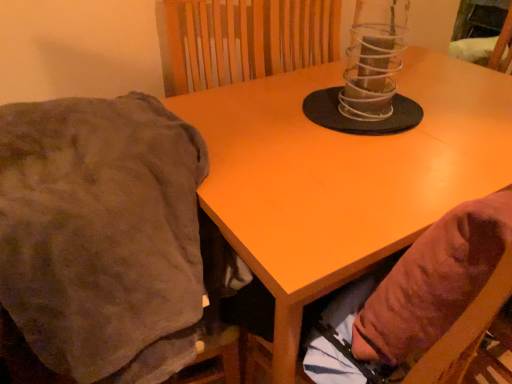
At what (x,y) coordinates should I click in order to perform the action: click on clear plastic candle holder at center. Please return your answer as a coordinate pair (x, y). Looking at the image, I should click on (371, 71).

What do you see at coordinates (342, 176) in the screenshot?
I see `matte orange table at center` at bounding box center [342, 176].

I want to click on brown fabric bean bag chair at lower right, so click(x=426, y=283).

Which is more to the right, matte orange table at center or brown fuzzy blanket at left?

matte orange table at center.

Is point (287, 243) closer to camera compared to point (5, 160)?

No, it is not.

From the image's perspective, between matte orange table at center and brown fuzzy blanket at left, which one is located above?

matte orange table at center.

Is matte orange table at center thinner than brown fuzzy blanket at left?

In fact, matte orange table at center might be wider than brown fuzzy blanket at left.

From a real-world perspective, is brown fuzzy blanket at left physically below matte orange table at center?

No, from a real-world perspective, brown fuzzy blanket at left is not below matte orange table at center.

You are a GUI agent. You are given a task and a screenshot of the screen. Output one action in this format:
    pyautogui.click(x=<x>, y=<y>)
    Task: Click on the blanket lying on the left of matte orange table at center
    This screenshot has width=512, height=384.
    Given the screenshot: What is the action you would take?
    pyautogui.click(x=102, y=235)

Considering the relative positions of brown fuzzy blanket at left and matte orange table at center in the image provided, is brown fuzzy blanket at left behind matte orange table at center?

No, brown fuzzy blanket at left is closer to the camera.

Could matte orange table at center be considered to be inside brown fuzzy blanket at left?

Actually, matte orange table at center is outside brown fuzzy blanket at left.

From a real-world perspective, which is physically below, matte orange table at center or clear plastic candle holder at center?

In real-world perspective, matte orange table at center is lower.

Do you think matte orange table at center is within clear plastic candle holder at center, or outside of it?

matte orange table at center lies outside clear plastic candle holder at center.

Consider the image. Which of these two, matte orange table at center or clear plastic candle holder at center, is wider?

matte orange table at center.

The image size is (512, 384). In order to click on candle holder behind the matte orange table at center in this screenshot , I will do `click(371, 71)`.

Is point (264, 175) behind point (447, 232)?

Yes.

Is matte orange table at center to the left or to the right of brown fabric bean bag chair at lower right in the image?

matte orange table at center is to the left of brown fabric bean bag chair at lower right.

From a real-world perspective, is matte orange table at center on brown fabric bean bag chair at lower right?

No, from a real-world perspective, matte orange table at center is not on top of brown fabric bean bag chair at lower right.

Can you confirm if matte orange table at center is wider than brown fabric bean bag chair at lower right?

Correct, the width of matte orange table at center exceeds that of brown fabric bean bag chair at lower right.

Which point is more forward, (56, 286) or (368, 54)?

Positioned in front is point (56, 286).

Considering the relative sizes of brown fuzzy blanket at left and clear plastic candle holder at center in the image provided, is brown fuzzy blanket at left smaller than clear plastic candle holder at center?

Incorrect, brown fuzzy blanket at left is not smaller in size than clear plastic candle holder at center.

Which object is further away from the camera, brown fuzzy blanket at left or clear plastic candle holder at center?

clear plastic candle holder at center.

Is brown fuzzy blanket at left shorter than clear plastic candle holder at center?

In fact, brown fuzzy blanket at left may be taller than clear plastic candle holder at center.

Between point (41, 321) and point (489, 212), which one is positioned behind?

The point (41, 321) is farther from the camera.

From a real-world perspective, which object stands above the other?

From a 3D spatial view, brown fabric bean bag chair at lower right is above.

Which of these two, brown fuzzy blanket at left or brown fabric bean bag chair at lower right, stands taller?

brown fuzzy blanket at left.

The height and width of the screenshot is (384, 512). Find the location of `bean bag chair above the brown fuzzy blanket at left (from the image's perspective)`. bean bag chair above the brown fuzzy blanket at left (from the image's perspective) is located at coordinates (426, 283).

Is clear plastic candle holder at center spatially inside matte orange table at center, or outside of it?

clear plastic candle holder at center is located beyond the bounds of matte orange table at center.

Considering the relative sizes of clear plastic candle holder at center and matte orange table at center in the image provided, is clear plastic candle holder at center shorter than matte orange table at center?

Yes, clear plastic candle holder at center is shorter than matte orange table at center.

How different are the orientations of clear plastic candle holder at center and matte orange table at center in degrees?

0.886 degrees.

From a real-world perspective, is clear plastic candle holder at center under matte orange table at center?

No, from a real-world perspective, clear plastic candle holder at center is not beneath matte orange table at center.

The image size is (512, 384). I want to click on blanket on the left of matte orange table at center, so click(x=102, y=235).

At what (x,y) coordinates should I click in order to perform the action: click on table below the brown fuzzy blanket at left (from a real-world perspective). Please return your answer as a coordinate pair (x, y). The image size is (512, 384). Looking at the image, I should click on (342, 176).

Estimate the real-world distances between objects in this image. Which object is further from matte orange table at center, brown fuzzy blanket at left or brown fabric bean bag chair at lower right?

The object further to matte orange table at center is brown fuzzy blanket at left.

In the scene shown: When comparing their distances from brown fuzzy blanket at left, does matte orange table at center or brown fabric bean bag chair at lower right seem further?

brown fabric bean bag chair at lower right lies further to brown fuzzy blanket at left than the other object.

Which object lies further to the anchor point brown fabric bean bag chair at lower right, clear plastic candle holder at center or brown fuzzy blanket at left?

Among the two, clear plastic candle holder at center is located further to brown fabric bean bag chair at lower right.

Based on their spatial positions, is matte orange table at center or clear plastic candle holder at center further from brown fuzzy blanket at left?

The object further to brown fuzzy blanket at left is clear plastic candle holder at center.

Estimate the real-world distances between objects in this image. Which object is further from brown fuzzy blanket at left, brown fabric bean bag chair at lower right or clear plastic candle holder at center?

The object further to brown fuzzy blanket at left is clear plastic candle holder at center.

Looking at the image, which one is located closer to clear plastic candle holder at center, brown fuzzy blanket at left or matte orange table at center?

Among the two, matte orange table at center is located nearer to clear plastic candle holder at center.

Looking at the image, which one is located further to clear plastic candle holder at center, matte orange table at center or brown fuzzy blanket at left?

brown fuzzy blanket at left lies further to clear plastic candle holder at center than the other object.

Estimate the real-world distances between objects in this image. Which object is further from clear plastic candle holder at center, matte orange table at center or brown fabric bean bag chair at lower right?

brown fabric bean bag chair at lower right is further to clear plastic candle holder at center.

Locate an element on the screen. candle holder situated between brown fuzzy blanket at left and matte orange table at center from left to right is located at coordinates (371, 71).

I want to click on table that lies between clear plastic candle holder at center and brown fabric bean bag chair at lower right from top to bottom, so click(342, 176).

Image resolution: width=512 pixels, height=384 pixels. What are the coordinates of `table between brown fuzzy blanket at left and brown fabric bean bag chair at lower right in the horizontal direction` in the screenshot? It's located at (342, 176).

The width and height of the screenshot is (512, 384). Find the location of `candle holder situated between brown fuzzy blanket at left and brown fabric bean bag chair at lower right from left to right`. candle holder situated between brown fuzzy blanket at left and brown fabric bean bag chair at lower right from left to right is located at coordinates (371, 71).